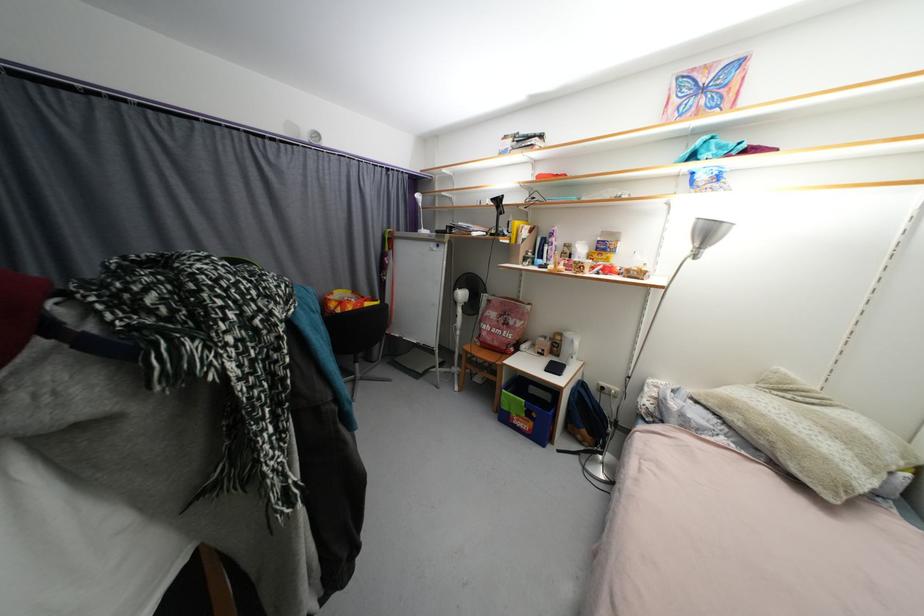
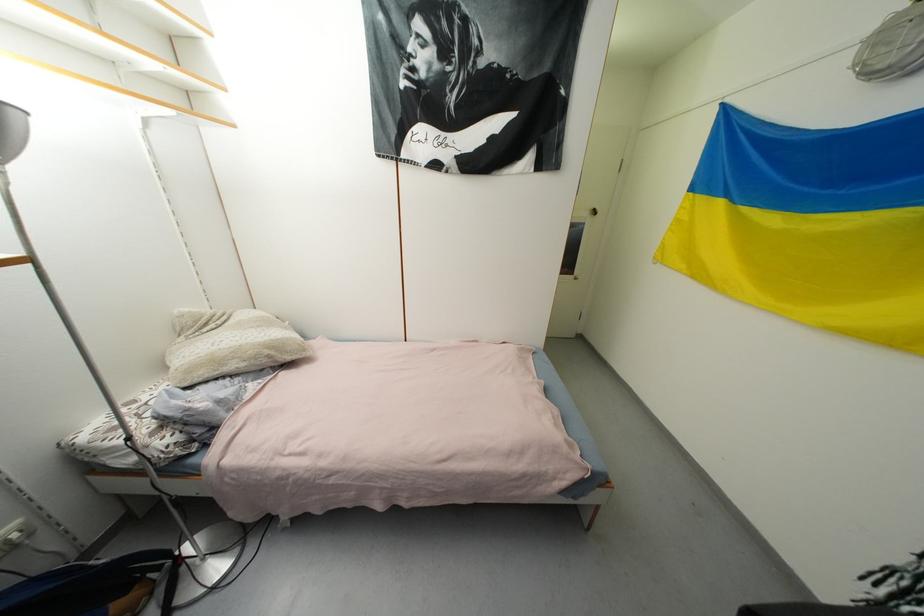
Locate, in the second image, the point that corresponds to point (764, 434) in the first image.

(261, 359)